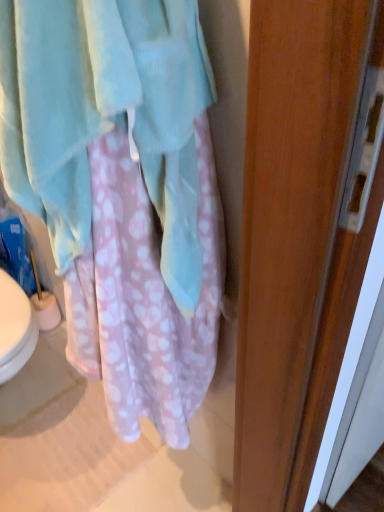
Describe the element at coordinates (105, 115) in the screenshot. The width and height of the screenshot is (384, 512). I see `soft pink fabric towel at center` at that location.

Where is `soft pink fabric towel at center`? This screenshot has width=384, height=512. soft pink fabric towel at center is located at coordinates (105, 115).

What is the approximate height of soft pink fabric towel at center?

19.35 inches.

Find the location of `soft pink fabric towel at center`. soft pink fabric towel at center is located at coordinates (105, 115).